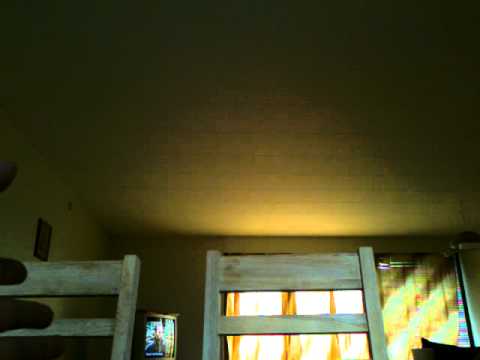
In order to click on window in this screenshot , I will do `click(318, 297)`.